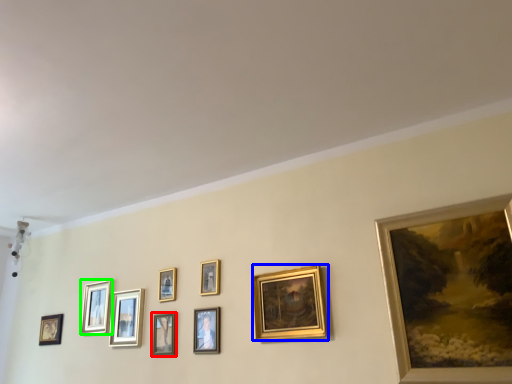
Question: Which is nearer to the picture frame (highlighted by a red box)? picture frame (highlighted by a blue box) or picture frame (highlighted by a green box).

Choices:
 (A) picture frame
 (B) picture frame

Answer: (B)